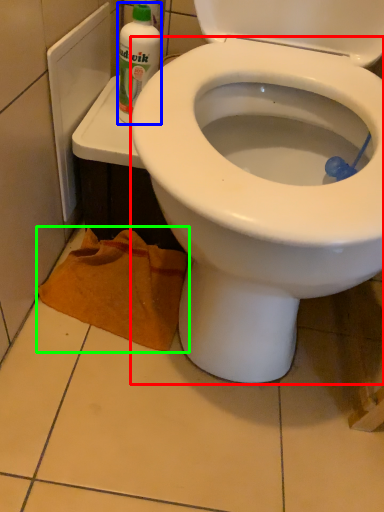
Question: Which object is the closest to the bidet (highlighted by a red box)? Choose among these: cleaning product (highlighted by a blue box) or material (highlighted by a green box).

Choices:
 (A) cleaning product
 (B) material

Answer: (B)